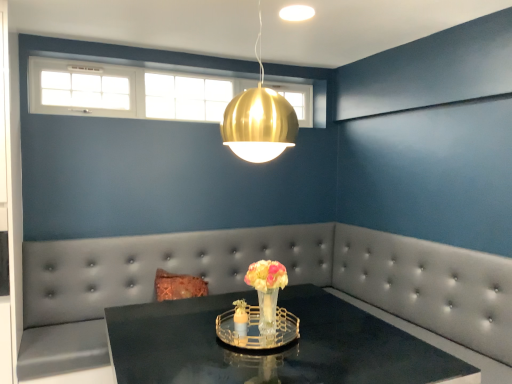
The height and width of the screenshot is (384, 512). What are the coordinates of `empty space that is ontop of white glass window at upper center (from a real-world perspective)` in the screenshot? It's located at (117, 65).